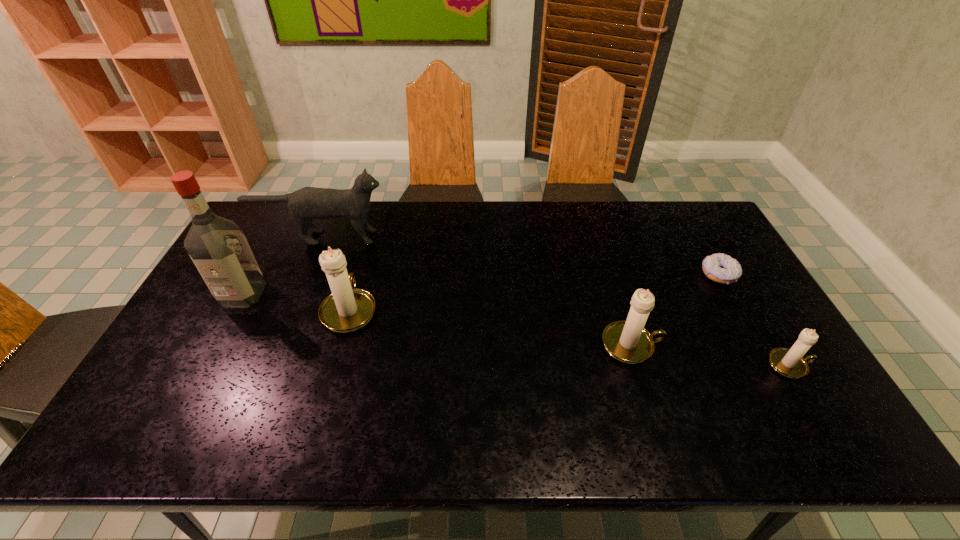
What are the coordinates of `doughnut present at the right edge` in the screenshot? It's located at (721, 268).

The image size is (960, 540). In order to click on object present at the far left corner in this screenshot , I will do `click(308, 203)`.

Identify the location of object at the near right corner. (788, 362).

Where is `vacant area at the far edge of the desktop`? The width and height of the screenshot is (960, 540). vacant area at the far edge of the desktop is located at coordinates (399, 226).

The image size is (960, 540). In the image, there is a desktop. What are the coordinates of `free space at the near edge` in the screenshot? It's located at (548, 399).

Where is `vacant space at the left edge`? The image size is (960, 540). vacant space at the left edge is located at coordinates (247, 309).

The width and height of the screenshot is (960, 540). I want to click on vacant region at the right edge of the desktop, so click(x=703, y=245).

Image resolution: width=960 pixels, height=540 pixels. In the image, there is a desktop. Identify the location of vacant space at the far left corner. (269, 225).

The image size is (960, 540). Identify the location of free space at the near left corner of the desktop. (172, 400).

At what (x,y) coordinates should I click in order to perform the action: click on vacant space at the far right corner. Please return your answer as a coordinate pair (x, y). This screenshot has height=540, width=960. Looking at the image, I should click on [696, 205].